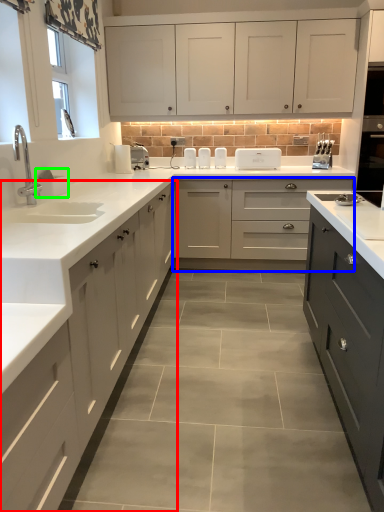
Question: Which object is the closest to the cabinetry (highlighted by a red box)? Choose among these: cabinetry (highlighted by a blue box) or appliance (highlighted by a green box).

Choices:
 (A) cabinetry
 (B) appliance

Answer: (B)